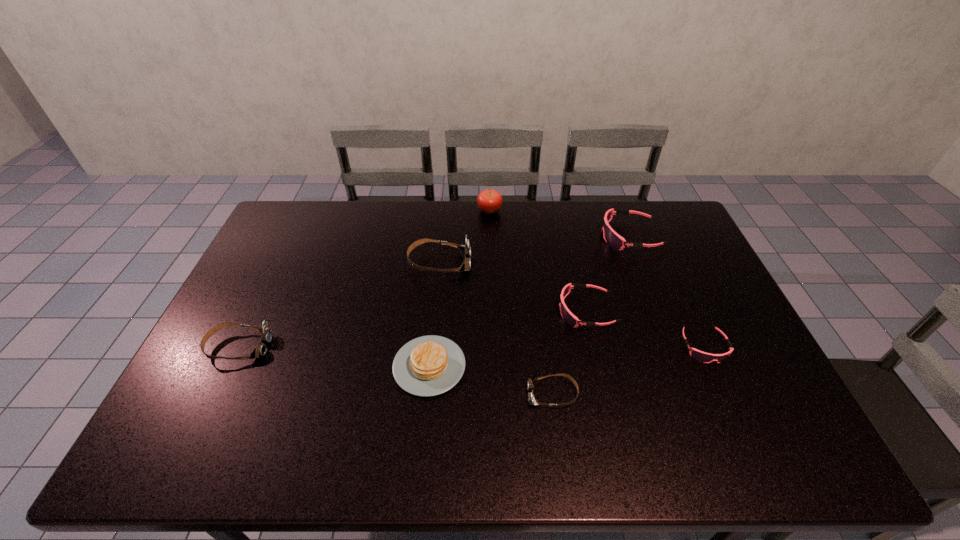
I want to click on the fourth object from left to right, so click(489, 201).

Locate an element on the screen. The height and width of the screenshot is (540, 960). the farthest object is located at coordinates (489, 201).

Locate an element on the screen. This screenshot has width=960, height=540. the biggest pink goggles is located at coordinates (613, 239).

Where is `the farthest brown goggles`? The image size is (960, 540). the farthest brown goggles is located at coordinates (465, 250).

Image resolution: width=960 pixels, height=540 pixels. Identify the location of the second goggles from left to right. (465, 250).

Image resolution: width=960 pixels, height=540 pixels. I want to click on the second smallest pink goggles, so click(x=570, y=318).

Locate an element on the screen. Image resolution: width=960 pixels, height=540 pixels. the second biggest brown goggles is located at coordinates (266, 333).

The image size is (960, 540). In order to click on the second nearest brown goggles in this screenshot , I will do `click(266, 333)`.

Identify the location of pancake. The width and height of the screenshot is (960, 540). (430, 365).

This screenshot has width=960, height=540. I want to click on the smallest pink goggles, so click(x=701, y=356).